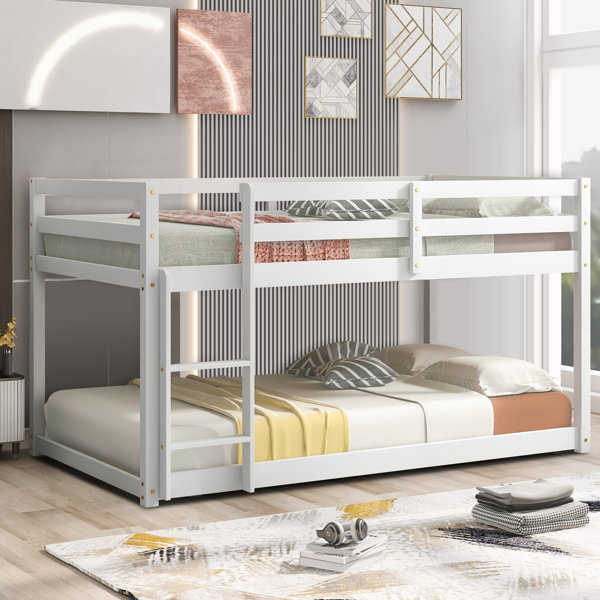
Locate an element on the screen. bunk beds is located at coordinates (149, 253).